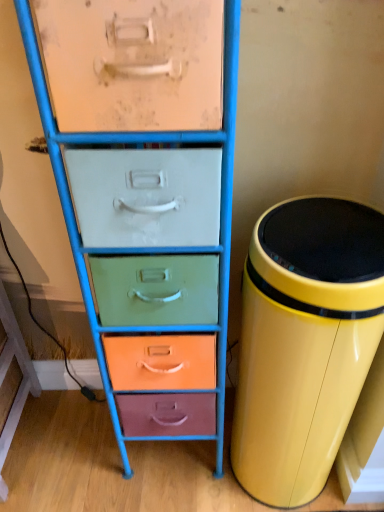
Where is `vacant space that is to the left of metallic drawer unit at center`? Image resolution: width=384 pixels, height=512 pixels. vacant space that is to the left of metallic drawer unit at center is located at coordinates (74, 448).